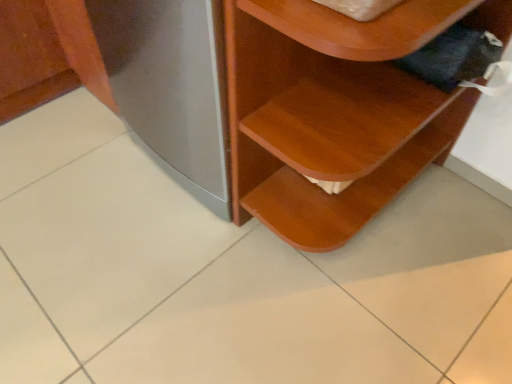
Image resolution: width=512 pixels, height=384 pixels. Find the location of `free spot to the right of wooden shelf at center`. free spot to the right of wooden shelf at center is located at coordinates (455, 228).